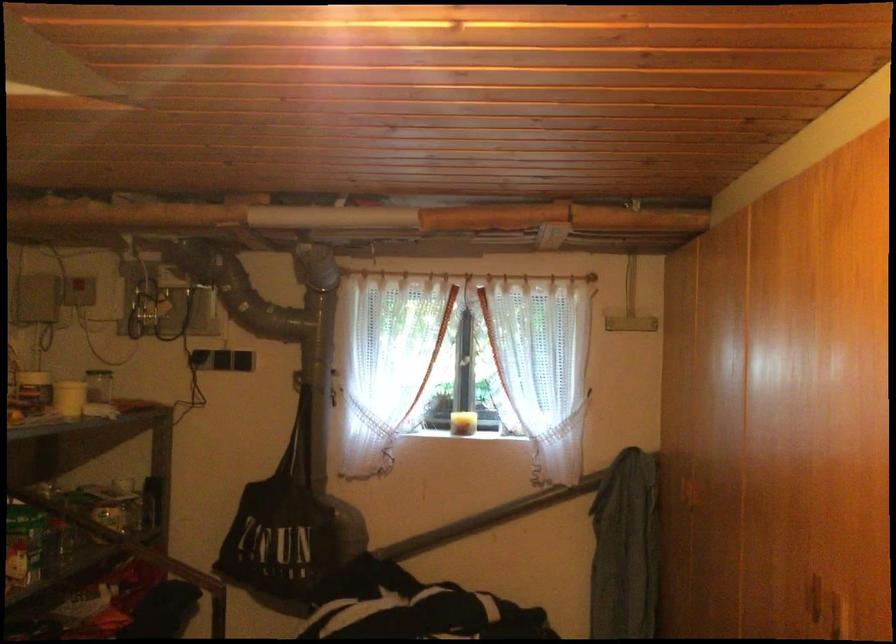
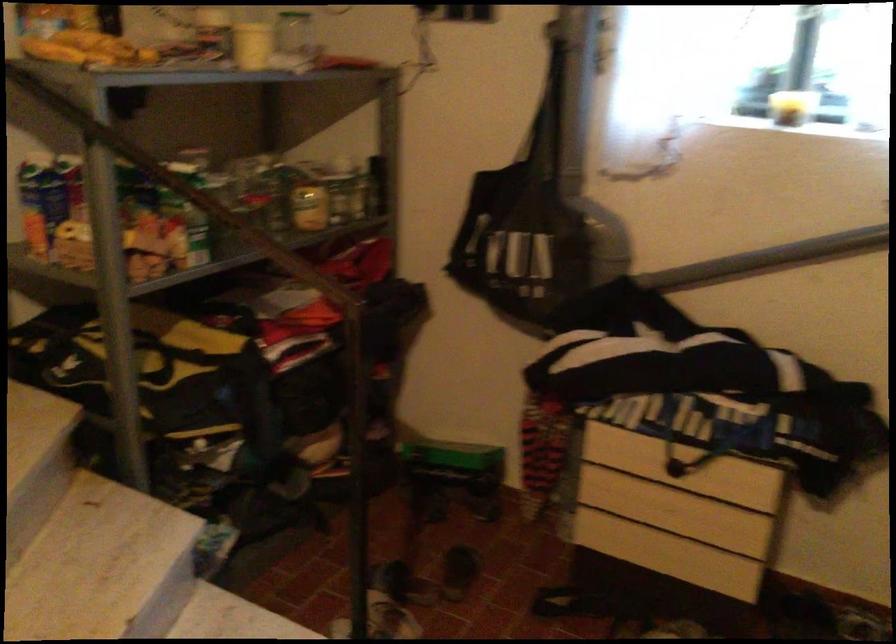
The point at (x=101, y=525) is marked in the first image. Where is the corresponding point in the second image?

(309, 205)